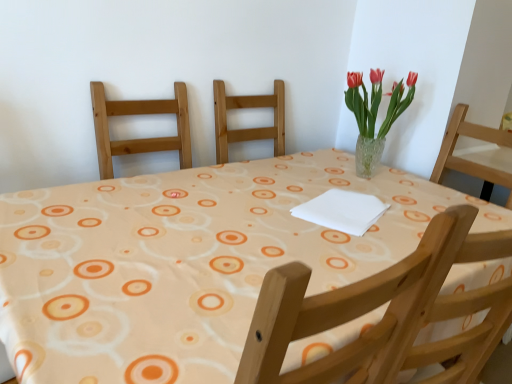
Question: Is matte orange tablecloth at center oriented away from translucent glass vase at upper right?

Choices:
 (A) yes
 (B) no

Answer: (B)

Question: Can you confirm if matte orange tablecloth at center is smaller than translucent glass vase at upper right?

Choices:
 (A) no
 (B) yes

Answer: (A)

Question: Does matte orange tablecloth at center appear on the left side of translucent glass vase at upper right?

Choices:
 (A) no
 (B) yes

Answer: (B)

Question: Is matte orange tablecloth at center positioned behind translucent glass vase at upper right?

Choices:
 (A) no
 (B) yes

Answer: (A)

Question: Can you confirm if matte orange tablecloth at center is shorter than translucent glass vase at upper right?

Choices:
 (A) yes
 (B) no

Answer: (B)

Question: Is matte orange tablecloth at center touching translucent glass vase at upper right?

Choices:
 (A) yes
 (B) no

Answer: (B)

Question: From a real-world perspective, is translucent glass vase at upper right physically below matte orange tablecloth at center?

Choices:
 (A) yes
 (B) no

Answer: (B)

Question: From the image's perspective, would you say translucent glass vase at upper right is positioned over matte orange tablecloth at center?

Choices:
 (A) yes
 (B) no

Answer: (A)

Question: Is translucent glass vase at upper right closer to the viewer compared to matte orange tablecloth at center?

Choices:
 (A) no
 (B) yes

Answer: (A)

Question: From the image's perspective, is translucent glass vase at upper right below matte orange tablecloth at center?

Choices:
 (A) yes
 (B) no

Answer: (B)

Question: Considering the relative sizes of translucent glass vase at upper right and matte orange tablecloth at center in the image provided, is translucent glass vase at upper right thinner than matte orange tablecloth at center?

Choices:
 (A) yes
 (B) no

Answer: (A)

Question: Is translucent glass vase at upper right located outside matte orange tablecloth at center?

Choices:
 (A) yes
 (B) no

Answer: (A)

Question: Is translucent glass vase at upper right to the left or to the right of matte orange tablecloth at center in the image?

Choices:
 (A) left
 (B) right

Answer: (B)